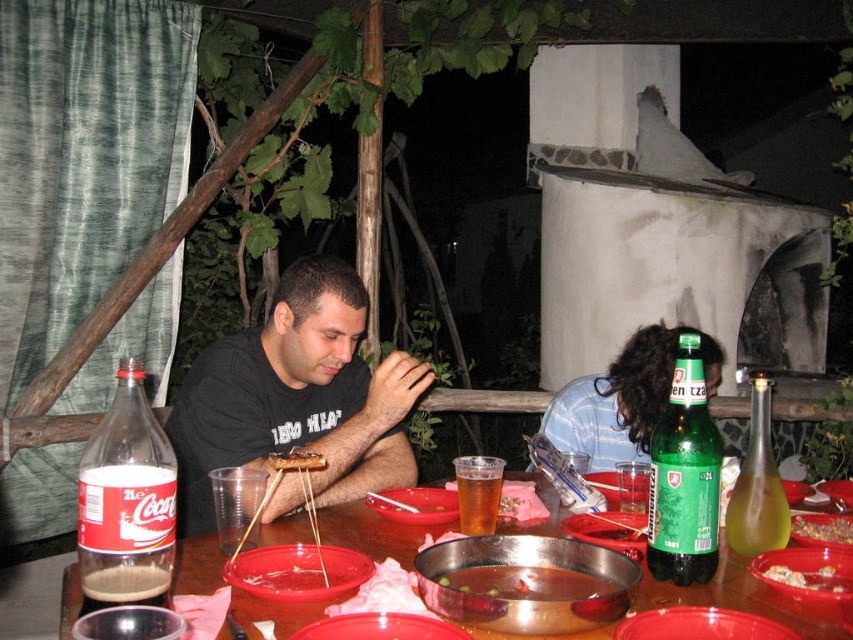
Who is more forward, (x=373, y=435) or (x=587, y=596)?

Point (x=587, y=596)

Measure the distance between black matte shirt at center and shiny metallic pot at center.

black matte shirt at center and shiny metallic pot at center are 28.05 inches apart.

At what (x,y) coordinates should I click in order to perform the action: click on black matte shirt at center. Please return your answer as a coordinate pair (x, y). The width and height of the screenshot is (853, 640). Looking at the image, I should click on (297, 396).

Locate an element on the screen. The height and width of the screenshot is (640, 853). black matte shirt at center is located at coordinates (297, 396).

Is dark blue shirt at center below shiny metallic pot at center?

No.

Describe the element at coordinates (624, 397) in the screenshot. I see `dark blue shirt at center` at that location.

In order to click on dark blue shirt at center in this screenshot , I will do `click(624, 397)`.

In the scene shown: Who is lower down, translucent plastic table at center or matte plastic plate at center?

translucent plastic table at center

The image size is (853, 640). I want to click on translucent plastic table at center, so click(x=744, y=600).